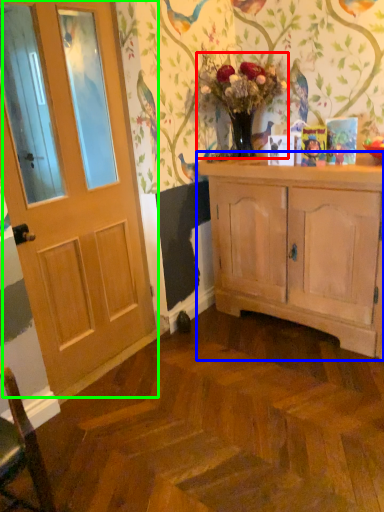
Question: Which object is positioned closest to floral arrangement (highlighted by a red box)? Select from cabinetry (highlighted by a blue box) and door (highlighted by a green box).

Choices:
 (A) cabinetry
 (B) door

Answer: (A)